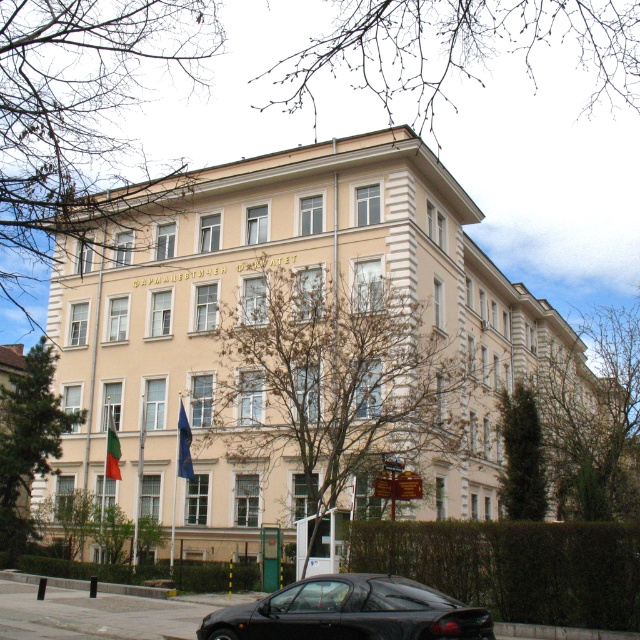
Can you confirm if blue fabric flag at center is smaller than red fabric flag at center?

Yes, blue fabric flag at center is smaller than red fabric flag at center.

Who is more distant from viewer, [186,472] or [113,429]?

The point [113,429] is behind.

I want to click on blue fabric flag at center, so click(182, 445).

Does beige stone building at center lie behind black matte car at lower center?

Yes, it is.

Is beige stone building at center above black matte car at lower center?

Yes.

Which is behind, point (310, 500) or point (380, 593)?

Positioned behind is point (310, 500).

Image resolution: width=640 pixels, height=640 pixels. I want to click on beige stone building at center, so click(x=291, y=340).

Between black matte car at lower center and red fabric flag at center, which one has more height?

With more height is red fabric flag at center.

Is point (401, 582) closer to viewer compared to point (118, 477)?

Yes, point (401, 582) is closer to viewer.

Find the location of a particular element. black matte car at lower center is located at coordinates (349, 612).